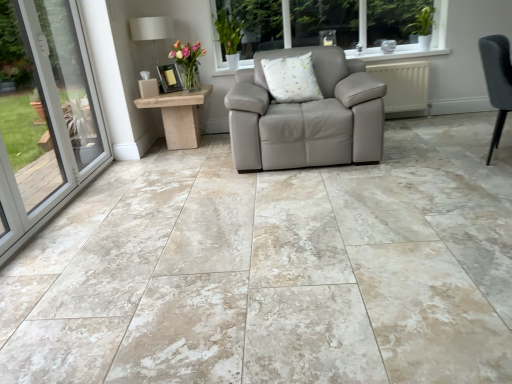
Question: From the image's perspective, is dark gray fabric chair at right on beige marble floor at center?

Choices:
 (A) no
 (B) yes

Answer: (B)

Question: Are dark gray fabric chair at right and beige marble floor at center far apart?

Choices:
 (A) yes
 (B) no

Answer: (A)

Question: Is dark gray fabric chair at right at the right side of beige marble floor at center?

Choices:
 (A) no
 (B) yes

Answer: (B)

Question: Is beige marble floor at center completely or partially inside dark gray fabric chair at right?

Choices:
 (A) yes
 (B) no

Answer: (B)

Question: Is dark gray fabric chair at right positioned in front of beige marble floor at center?

Choices:
 (A) yes
 (B) no

Answer: (B)

Question: Can you confirm if dark gray fabric chair at right is smaller than beige marble floor at center?

Choices:
 (A) yes
 (B) no

Answer: (A)

Question: Is translucent glass vase at upper center bigger than wooden side table at left?

Choices:
 (A) no
 (B) yes

Answer: (A)

Question: Can you confirm if translucent glass vase at upper center is smaller than wooden side table at left?

Choices:
 (A) yes
 (B) no

Answer: (A)

Question: Would you say translucent glass vase at upper center is outside wooden side table at left?

Choices:
 (A) yes
 (B) no

Answer: (A)

Question: Is translucent glass vase at upper center wider than wooden side table at left?

Choices:
 (A) no
 (B) yes

Answer: (A)

Question: Can you confirm if translucent glass vase at upper center is positioned to the left of wooden side table at left?

Choices:
 (A) no
 (B) yes

Answer: (A)

Question: From a real-world perspective, is translucent glass vase at upper center on wooden side table at left?

Choices:
 (A) yes
 (B) no

Answer: (A)

Question: From a real-world perspective, is translucent glass vase at upper center over beige marble floor at center?

Choices:
 (A) yes
 (B) no

Answer: (A)